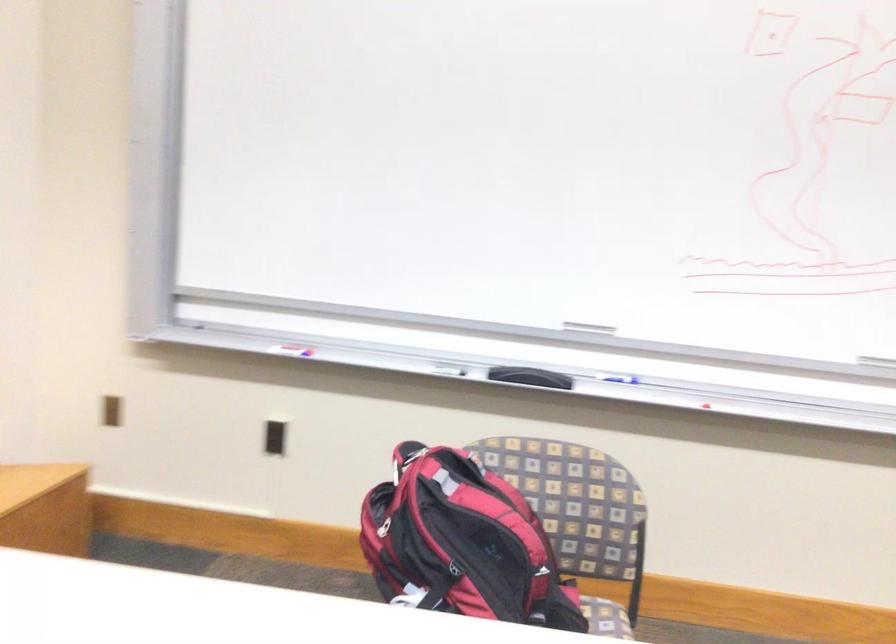
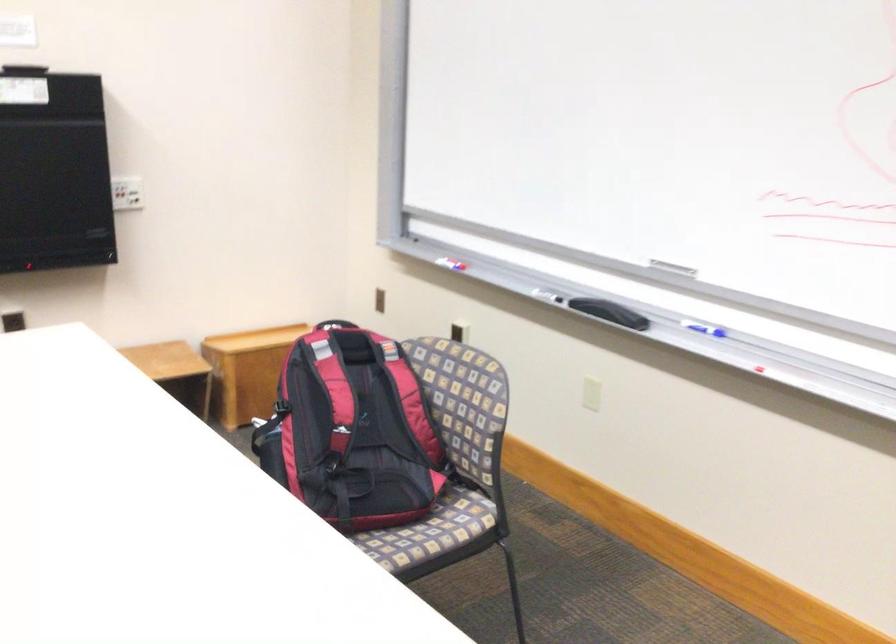
Locate, in the second image, the point that corresponds to [615,377] in the first image.

(702, 328)